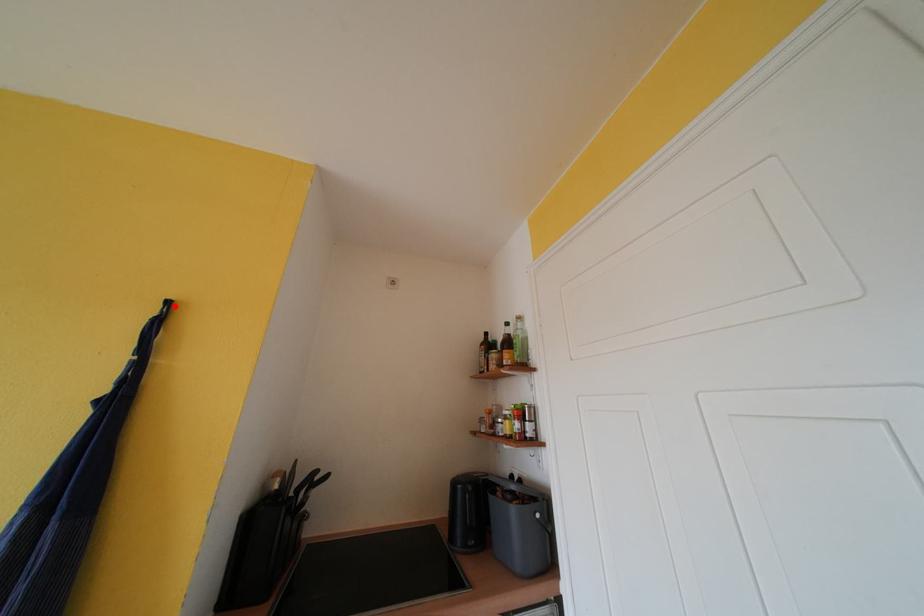
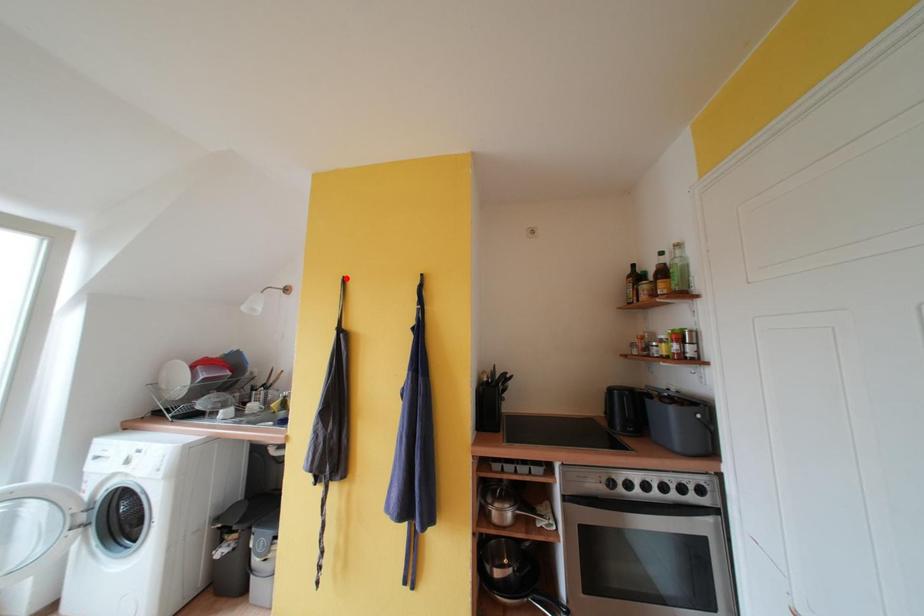
I am providing you with two images of the same scene from different viewpoints. A red point is marked on the first image and another point is marked on the second image. Are the points marked in image1 and image2 representing the same 3D position?

No